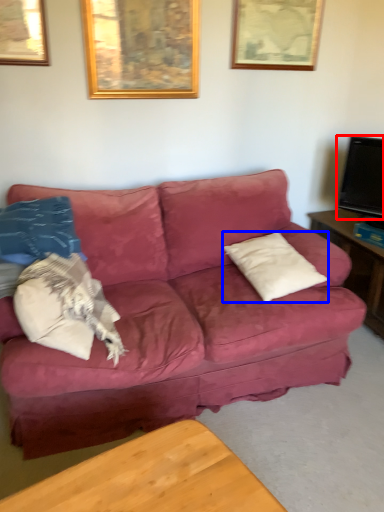
Question: Which object is further to the camera taking this photo, television (highlighted by a red box) or pillow (highlighted by a blue box)?

Choices:
 (A) television
 (B) pillow

Answer: (A)